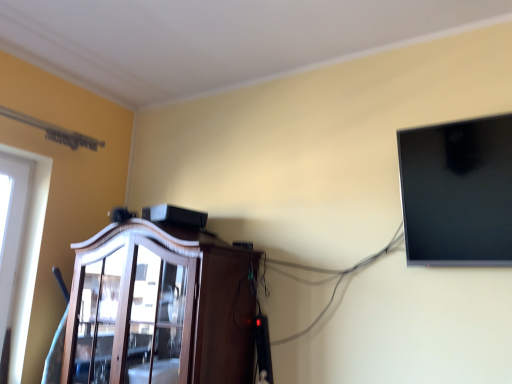
This screenshot has height=384, width=512. What do you see at coordinates (160, 308) in the screenshot? I see `dark wood cabinet at center` at bounding box center [160, 308].

Measure the distance between point (232,344) and camera.

They are 5.75 feet apart.

Measure the distance between dark wood cabinet at center and camera.

dark wood cabinet at center and camera are 5.11 feet apart from each other.

Find the location of a particular element. Image resolution: width=512 pixels, height=384 pixels. dark wood cabinet at center is located at coordinates (160, 308).

What do you see at coordinates (457, 192) in the screenshot? This screenshot has height=384, width=512. I see `matte black monitor at upper right` at bounding box center [457, 192].

Find the location of a particular element. This screenshot has width=512, height=384. matte black monitor at upper right is located at coordinates (457, 192).

In order to face matte black monitor at upper right, should I rotate leftwards or rightwards?

You should look right and rotate roughly 24.551 degrees.

Where is `dark wood cabinet at center`? dark wood cabinet at center is located at coordinates (160, 308).

Is dark wood cabinet at center to the right of matte black monitor at upper right from the viewer's perspective?

In fact, dark wood cabinet at center is to the left of matte black monitor at upper right.

Which object is closer to the camera taking this photo, dark wood cabinet at center or matte black monitor at upper right?

matte black monitor at upper right is more forward.

Between point (93, 313) and point (407, 252), which one is positioned behind?

The point (93, 313) is more distant.

From the image's perspective, is dark wood cabinet at center on top of matte black monitor at upper right?

No, from the image's perspective, dark wood cabinet at center is not above matte black monitor at upper right.

From a real-world perspective, is dark wood cabinet at center above or below matte black monitor at upper right?

dark wood cabinet at center is below matte black monitor at upper right.

Is dark wood cabinet at center wider than matte black monitor at upper right?

Indeed, dark wood cabinet at center has a greater width compared to matte black monitor at upper right.

Does dark wood cabinet at center have a lesser height compared to matte black monitor at upper right?

Incorrect, the height of dark wood cabinet at center does not fall short of that of matte black monitor at upper right.

Between dark wood cabinet at center and matte black monitor at upper right, which one has larger size?

dark wood cabinet at center.

Is dark wood cabinet at center outside of matte black monitor at upper right?

That's correct, dark wood cabinet at center is outside of matte black monitor at upper right.

Is dark wood cabinet at center next to matte black monitor at upper right?

No, dark wood cabinet at center is not making contact with matte black monitor at upper right.

Does dark wood cabinet at center turn towards matte black monitor at upper right?

No, dark wood cabinet at center is not aimed at matte black monitor at upper right.

Can you tell me how much dark wood cabinet at center and matte black monitor at upper right differ in facing direction?

2.16 degrees separate the facing orientations of dark wood cabinet at center and matte black monitor at upper right.

This screenshot has height=384, width=512. What are the coordinates of `computer monitor positioned vertically above the dark wood cabinet at center (from a real-world perspective)` in the screenshot? It's located at click(x=457, y=192).

Considering the positions of objects matte black monitor at upper right and dark wood cabinet at center in the image provided, who is more to the right, matte black monitor at upper right or dark wood cabinet at center?

matte black monitor at upper right.

In the image, is matte black monitor at upper right positioned in front of or behind dark wood cabinet at center?

In the image, matte black monitor at upper right appears in front of dark wood cabinet at center.

Is point (421, 250) farther from camera compared to point (128, 296)?

That is False.

From the image's perspective, would you say matte black monitor at upper right is positioned over dark wood cabinet at center?

Yes, from the image's perspective, matte black monitor at upper right is above dark wood cabinet at center.

From a real-world perspective, is matte black monitor at upper right physically located above or below dark wood cabinet at center?

matte black monitor at upper right is situated higher than dark wood cabinet at center in the real world.

Considering the sizes of matte black monitor at upper right and dark wood cabinet at center in the image, is matte black monitor at upper right wider or thinner than dark wood cabinet at center?

In the image, matte black monitor at upper right appears to be more narrow than dark wood cabinet at center.

Does matte black monitor at upper right have a greater height compared to dark wood cabinet at center?

No, matte black monitor at upper right is not taller than dark wood cabinet at center.

Between matte black monitor at upper right and dark wood cabinet at center, which one has larger size?

With larger size is dark wood cabinet at center.

Is matte black monitor at upper right not within dark wood cabinet at center?

Yes, matte black monitor at upper right is located beyond the bounds of dark wood cabinet at center.

Would you say matte black monitor at upper right is a long distance from dark wood cabinet at center?

That's not correct — matte black monitor at upper right is a little close to dark wood cabinet at center.

Is matte black monitor at upper right facing towards dark wood cabinet at center?

No, matte black monitor at upper right is not turned towards dark wood cabinet at center.

Where is `computer monitor to the right of dark wood cabinet at center`? This screenshot has width=512, height=384. computer monitor to the right of dark wood cabinet at center is located at coordinates (457, 192).

What are the coordinates of `computer monitor on the right of the dark wood cabinet at center` in the screenshot? It's located at [457, 192].

The image size is (512, 384). I want to click on cabinetry that is behind the matte black monitor at upper right, so click(160, 308).